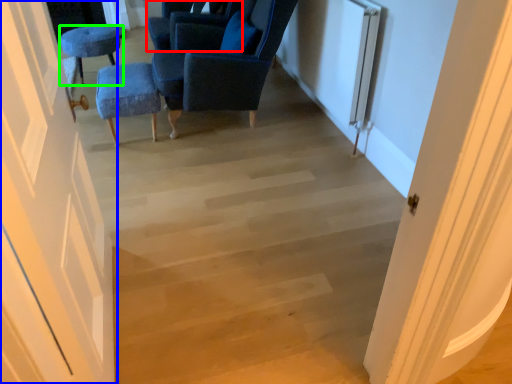
Question: Estimate the real-world distances between objects in this image. Which object is closer to chair (highlighted by a red box), door (highlighted by a blue box) or furniture (highlighted by a green box)?

Choices:
 (A) door
 (B) furniture

Answer: (B)